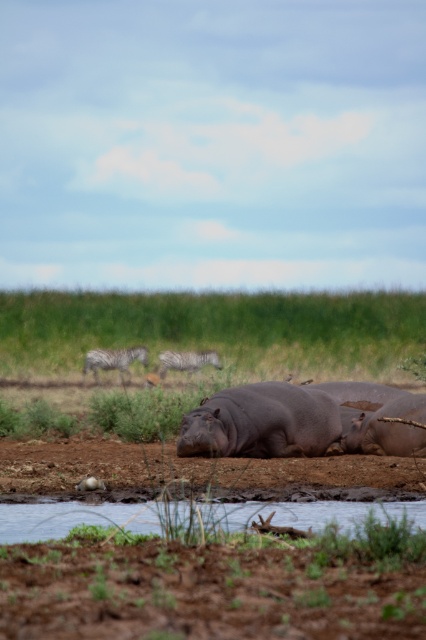
Question: Which point appears farthest from the camera in this image?

Choices:
 (A) (121, 352)
 (B) (219, 520)

Answer: (A)

Question: Can you confirm if matte gray hippo at center is thinner than gray striped zebra at center?

Choices:
 (A) no
 (B) yes

Answer: (A)

Question: Which point is closer to the camera taking this photo?

Choices:
 (A) (94, 356)
 (B) (218, 408)
 (C) (167, 339)
 (D) (417, 406)

Answer: (B)

Question: Which object appears closest to the camera in this image?

Choices:
 (A) matte gray hippo at center
 (B) gray striped zebra at center

Answer: (A)

Question: In this image, where is green grass at center located relative to matte gray hippo at center?

Choices:
 (A) left
 (B) right

Answer: (A)

Question: Is gray matte hippo at lower right wider than gray striped zebra at center?

Choices:
 (A) no
 (B) yes

Answer: (A)